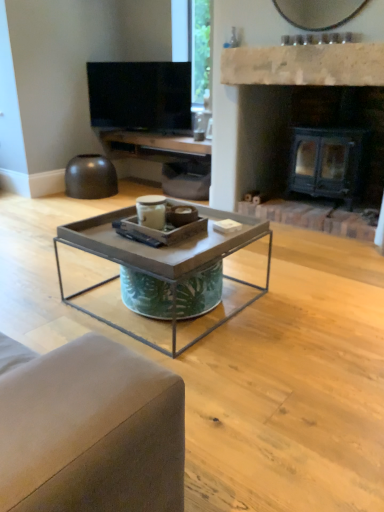
This screenshot has height=512, width=384. What do you see at coordinates (140, 95) in the screenshot? I see `flat screen tv at upper center` at bounding box center [140, 95].

At what (x,y) coordinates should I click in order to perform the action: click on flat screen tv at upper center. Please return your answer as a coordinate pair (x, y). Image resolution: width=384 pixels, height=512 pixels. Looking at the image, I should click on (140, 95).

In order to face matte wood entertainment center at upper center, should I rotate leftwards or rightwards?

Result: To face it directly, rotate left by 3.756 degrees.

What do you see at coordinates (165, 273) in the screenshot? This screenshot has width=384, height=512. I see `metal/texturedcoffee table at center` at bounding box center [165, 273].

Identify the location of white stone fireplace at upper center. This screenshot has height=512, width=384. (305, 65).

Is flat screen tv at upper center positioned with its back to matte wood entertainment center at upper center?

That's not correct — flat screen tv at upper center is not looking away from matte wood entertainment center at upper center.

Where is `entertainment center on the right of flat screen tv at upper center`? Image resolution: width=384 pixels, height=512 pixels. entertainment center on the right of flat screen tv at upper center is located at coordinates (166, 159).

From the image's perspective, which one is positioned higher, flat screen tv at upper center or matte wood entertainment center at upper center?

flat screen tv at upper center is shown above in the image.

Which object is wider, flat screen tv at upper center or matte wood entertainment center at upper center?

With larger width is matte wood entertainment center at upper center.

Is matte wood entertainment center at upper center wider or thinner than metal/texturedcoffee table at center?

Clearly, matte wood entertainment center at upper center has less width compared to metal/texturedcoffee table at center.

Is matte wood entertainment center at upper center at the right side of metal/texturedcoffee table at center?

In fact, matte wood entertainment center at upper center is to the left of metal/texturedcoffee table at center.

I want to click on coffee table below the matte wood entertainment center at upper center (from the image's perspective), so click(165, 273).

Which object is closer to the camera taking this photo, black metal fireplace at center or metal/texturedcoffee table at center?

metal/texturedcoffee table at center is closer to the camera.

Which point is more distant from viewer, (327, 189) or (222, 236)?

Positioned behind is point (327, 189).

From the picture: Which object is positioned more to the right, black metal fireplace at center or metal/texturedcoffee table at center?

From the viewer's perspective, black metal fireplace at center appears more on the right side.

Would you say black metal fireplace at center contains white stone fireplace at upper center?

No, white stone fireplace at upper center is located outside of black metal fireplace at center.

Which of these two, black metal fireplace at center or white stone fireplace at upper center, is bigger?

With larger size is black metal fireplace at center.

From the image's perspective, is black metal fireplace at center located above or below white stone fireplace at upper center?

Clearly, from the image's perspective, black metal fireplace at center is below white stone fireplace at upper center.

Is white stone fireplace at upper center placed right next to flat screen tv at upper center?

No, white stone fireplace at upper center is not in contact with flat screen tv at upper center.

This screenshot has height=512, width=384. I want to click on mantle below the flat screen tv at upper center (from the image's perspective), so click(x=305, y=65).

From the picture: Between white stone fireplace at upper center and flat screen tv at upper center, which one has larger width?

With larger width is flat screen tv at upper center.

Is white stone fireplace at upper center spatially inside flat screen tv at upper center, or outside of it?

white stone fireplace at upper center cannot be found inside flat screen tv at upper center.

Is flat screen tv at upper center wider or thinner than metal/texturedcoffee table at center?

In the image, flat screen tv at upper center appears to be more narrow than metal/texturedcoffee table at center.

From a real-world perspective, is flat screen tv at upper center physically above metal/texturedcoffee table at center?

Yes, from a real-world perspective, flat screen tv at upper center is above metal/texturedcoffee table at center.

Does point (186, 85) come behind point (234, 244)?

Yes, point (186, 85) is farther from viewer.

Is flat screen tv at upper center inside the boundaries of metal/texturedcoffee table at center, or outside?

flat screen tv at upper center is located beyond the bounds of metal/texturedcoffee table at center.

Is white stone fireplace at upper center at the back of metal/texturedcoffee table at center?

No, metal/texturedcoffee table at center is not facing the opposite direction of white stone fireplace at upper center.

Is metal/texturedcoffee table at center far away from white stone fireplace at upper center?

Yes.

Which is behind, metal/texturedcoffee table at center or white stone fireplace at upper center?

Positioned behind is white stone fireplace at upper center.

Which point is more forward, (124,260) or (343,72)?

Point (124,260)

Image resolution: width=384 pixels, height=512 pixels. In order to click on entertainment center that is below the flat screen tv at upper center (from the image's perspective) in this screenshot , I will do `click(166, 159)`.

The width and height of the screenshot is (384, 512). In order to click on entertainment center above the metal/texturedcoffee table at center (from the image's perspective) in this screenshot , I will do `click(166, 159)`.

When comparing their distances from flat screen tv at upper center, does white stone fireplace at upper center or metal/texturedcoffee table at center seem closer?

Among the two, white stone fireplace at upper center is located nearer to flat screen tv at upper center.

Based on their spatial positions, is matte wood entertainment center at upper center or metal/texturedcoffee table at center further from white stone fireplace at upper center?

The object further to white stone fireplace at upper center is metal/texturedcoffee table at center.

Consider the image. Estimate the real-world distances between objects in this image. Which object is further from white stone fireplace at upper center, flat screen tv at upper center or metal/texturedcoffee table at center?

metal/texturedcoffee table at center is positioned further to the anchor white stone fireplace at upper center.

Based on their spatial positions, is white stone fireplace at upper center or metal/texturedcoffee table at center closer to matte wood entertainment center at upper center?

white stone fireplace at upper center.

Looking at the image, which one is located further to white stone fireplace at upper center, black metal fireplace at center or flat screen tv at upper center?

Based on the image, flat screen tv at upper center appears to be further to white stone fireplace at upper center.

Based on their spatial positions, is metal/texturedcoffee table at center or white stone fireplace at upper center closer to black metal fireplace at center?

white stone fireplace at upper center is closer to black metal fireplace at center.

When comparing their distances from black metal fireplace at center, does metal/texturedcoffee table at center or matte wood entertainment center at upper center seem closer?

matte wood entertainment center at upper center is closer to black metal fireplace at center.

From the image, which object appears to be farther from metal/texturedcoffee table at center, matte wood entertainment center at upper center or black metal fireplace at center?

The object further to metal/texturedcoffee table at center is matte wood entertainment center at upper center.

Identify the location of mantle between matte wood entertainment center at upper center and black metal fireplace at center. (305, 65).

Where is `mantle between metal/texturedcoffee table at center and flat screen tv at upper center from front to back`? mantle between metal/texturedcoffee table at center and flat screen tv at upper center from front to back is located at coordinates (305, 65).

This screenshot has height=512, width=384. I want to click on entertainment center between flat screen tv at upper center and black metal fireplace at center, so click(166, 159).

You are a GUI agent. You are given a task and a screenshot of the screen. Output one action in this format:
    pyautogui.click(x=<x>, y=<y>)
    Task: Click on the mantle positioned between metal/texturedcoffee table at center and matte wood entertainment center at upper center from near to far
    This screenshot has width=384, height=512.
    Given the screenshot: What is the action you would take?
    pyautogui.click(x=305, y=65)